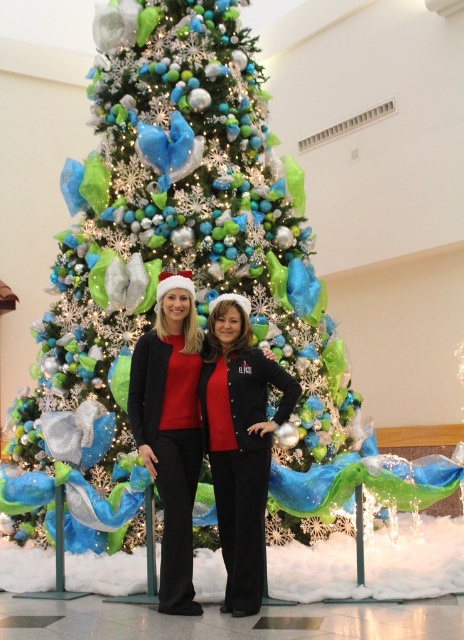
Is shiny metallic christmas tree at center below black matte jacket at center?

Actually, shiny metallic christmas tree at center is above black matte jacket at center.

How much distance is there between shiny metallic christmas tree at center and black matte jacket at center?

They are 6.80 feet apart.

Which is behind, point (315, 472) or point (230, 538)?

Point (315, 472)

Locate an element on the screen. shiny metallic christmas tree at center is located at coordinates (174, 269).

Who is higher up, black matte jacket at center or matte black pants at center?

matte black pants at center is higher up.

Between black matte jacket at center and matte black pants at center, which one appears on the right side from the viewer's perspective?

From the viewer's perspective, black matte jacket at center appears more on the right side.

Which is behind, point (212, 324) or point (167, 275)?

Point (167, 275)

Identify the location of black matte jacket at center. This screenshot has width=464, height=640. (239, 444).

Does shiny metallic christmas tree at center appear on the left side of matte black pants at center?

Yes, shiny metallic christmas tree at center is to the left of matte black pants at center.

Is point (174, 148) farther from camera compared to point (199, 342)?

Yes.

The height and width of the screenshot is (640, 464). In order to click on shiny metallic christmas tree at center in this screenshot , I will do `click(174, 269)`.